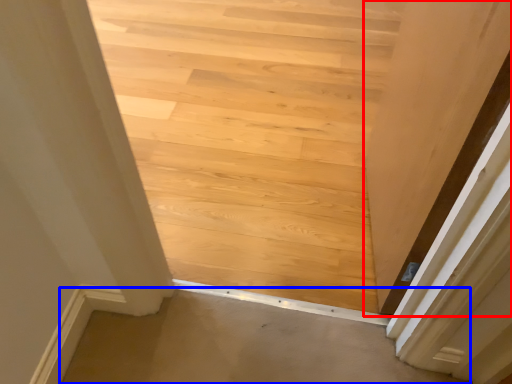
Question: Which of the following is the closest to the observer, door (highlighted by a red box) or plain (highlighted by a blue box)?

Choices:
 (A) door
 (B) plain

Answer: (A)